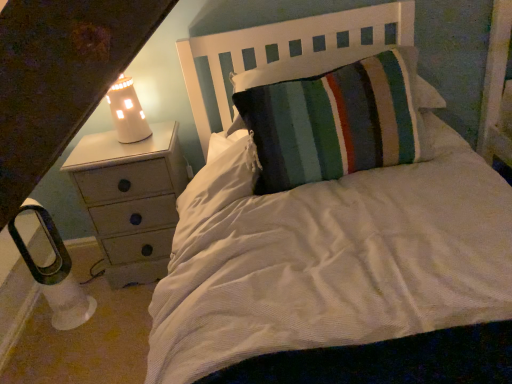
Question: Does white ceramic lamp at upper left, positioned as the 1th lamp in top-to-bottom order, appear on the left side of white wood headboard at upper center?

Choices:
 (A) yes
 (B) no

Answer: (A)

Question: Is white ceramic lamp at upper left, acting as the 2th lamp starting from the left, aimed at white wood headboard at upper center?

Choices:
 (A) no
 (B) yes

Answer: (A)

Question: Are white ceramic lamp at upper left, positioned as the 1th lamp in top-to-bottom order, and white wood headboard at upper center making contact?

Choices:
 (A) no
 (B) yes

Answer: (A)

Question: From the image's perspective, is white ceramic lamp at upper left, which is the 1th lamp from right to left, located beneath white wood headboard at upper center?

Choices:
 (A) no
 (B) yes

Answer: (B)

Question: Is white ceramic lamp at upper left, which is the 1th lamp from right to left, outside white wood headboard at upper center?

Choices:
 (A) yes
 (B) no

Answer: (A)

Question: From a real-world perspective, is white ceramic lamp at upper left, the 2th lamp ordered from the bottom, over white wood headboard at upper center?

Choices:
 (A) no
 (B) yes

Answer: (B)

Question: Is white wood headboard at upper center oriented towards white ceramic lamp at upper left, which is the 1th lamp from right to left?

Choices:
 (A) no
 (B) yes

Answer: (B)

Question: Is white wood headboard at upper center thinner than white ceramic lamp at upper left, positioned as the 1th lamp in top-to-bottom order?

Choices:
 (A) yes
 (B) no

Answer: (B)

Question: Is white wood headboard at upper center in front of white ceramic lamp at upper left, positioned as the 1th lamp in top-to-bottom order?

Choices:
 (A) yes
 (B) no

Answer: (A)

Question: Considering the relative sizes of white wood headboard at upper center and white ceramic lamp at upper left, the 2th lamp ordered from the bottom, in the image provided, is white wood headboard at upper center wider than white ceramic lamp at upper left, the 2th lamp ordered from the bottom,?

Choices:
 (A) yes
 (B) no

Answer: (A)

Question: Is the position of white wood headboard at upper center more distant than that of white ceramic lamp at upper left, the 2th lamp ordered from the bottom?

Choices:
 (A) yes
 (B) no

Answer: (B)

Question: Can you confirm if white wood headboard at upper center is taller than white ceramic lamp at upper left, which is the 1th lamp from right to left?

Choices:
 (A) no
 (B) yes

Answer: (A)

Question: Is white painted wood chest of drawers at left in front of white plastic lamp at lower left, the 2th lamp positioned from the right?

Choices:
 (A) yes
 (B) no

Answer: (B)